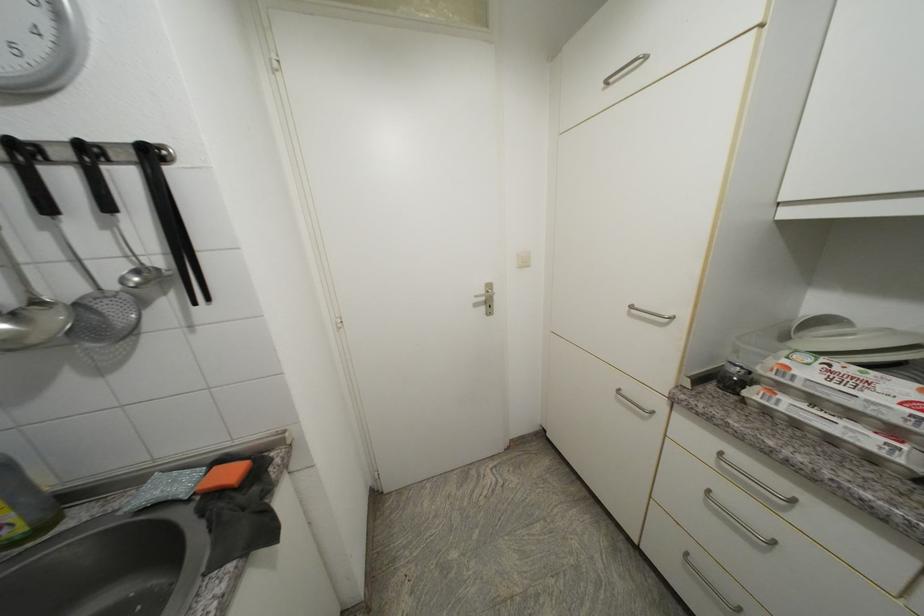
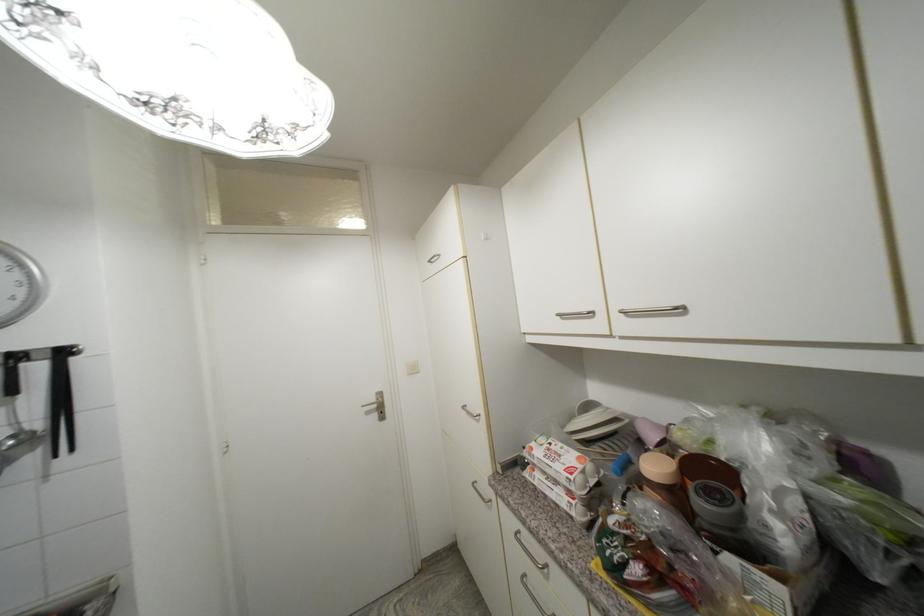
Question: The images are taken continuously from a first-person perspective. In which direction is your viewpoint rotating?

Choices:
 (A) Left
 (B) Right
 (C) Up
 (D) Down

Answer: (C)